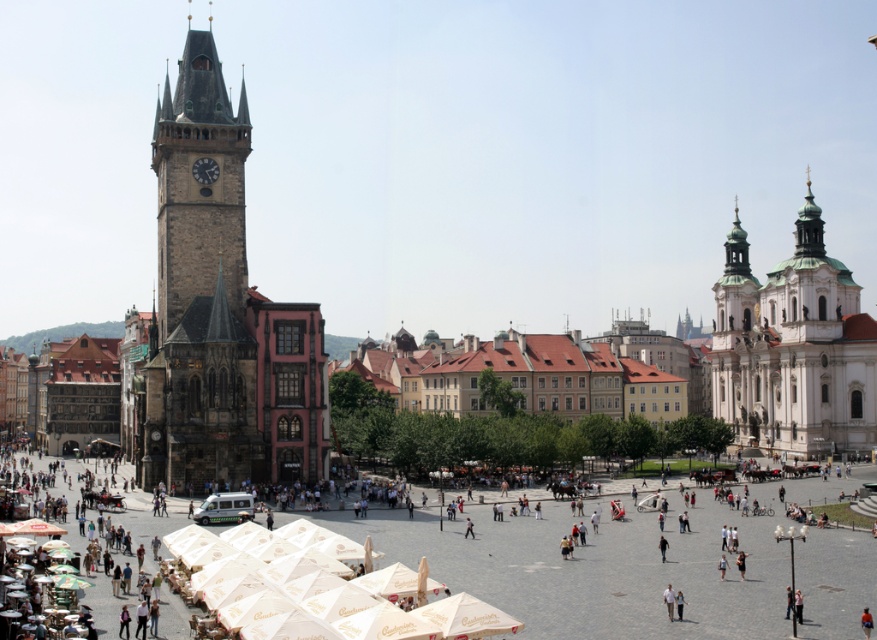
You are standing in the square and want to take a photo of both the Gothic tower and the white church with two green domes. You notice two specific points in the scene marked as point 1 at coordinates (223, 348) and point 2 at coordinates (745, 381). Which point should you stand closer to in order to ensure both landmarks are fully visible in your photo?

You should stand closer to point 1 at coordinates (223, 348) because it is closer to the viewer, allowing both the Gothic tower and the white church with two green domes to be fully captured in the photo.

Looking at this image, you are standing in the square and want to take a photo of both the stone clock tower at left and the white stone church at right. Which object should you position closer to the foreground to include both in your shot?

The stone clock tower at left is above the white stone church at right, so to include both in your photo, position the white stone church at right closer to the foreground.

You are a tourist standing in the square and want to take a photo that includes both the stone clock tower at left and the white stone church at right. Which building should you position closer to the camera to ensure both are fully visible in the frame?

To ensure both the stone clock tower at left and the white stone church at right are fully visible in the frame, you should position the stone clock tower at left closer to the camera since it is taller than the white stone church at right.